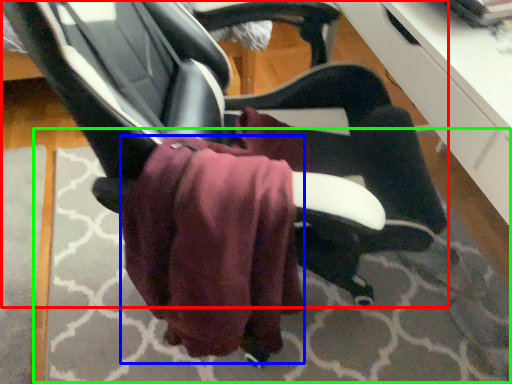
Question: Estimate the real-world distances between objects in this image. Which object is farther from chair (highlighted by a red box), bath towel (highlighted by a blue box) or mat (highlighted by a green box)?

Choices:
 (A) bath towel
 (B) mat

Answer: (B)